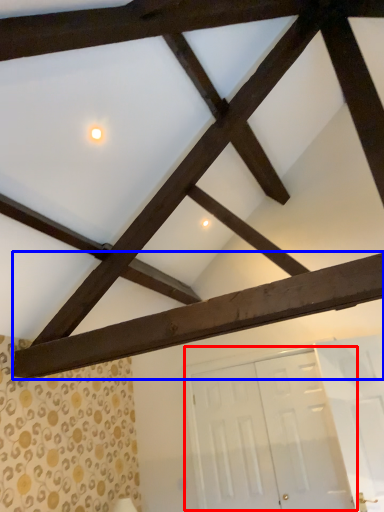
Question: Which object is closer to the camera taking this photo, door (highlighted by a red box) or plank (highlighted by a blue box)?

Choices:
 (A) door
 (B) plank

Answer: (B)